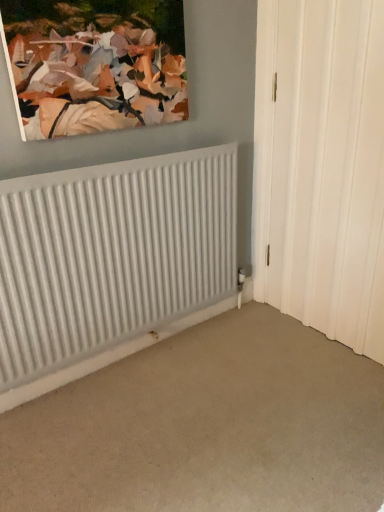
Question: Does white textured door at right have a greater width compared to matte canvas painting at upper left?

Choices:
 (A) yes
 (B) no

Answer: (B)

Question: Considering the relative positions of white textured door at right and matte canvas painting at upper left in the image provided, is white textured door at right to the right of matte canvas painting at upper left from the viewer's perspective?

Choices:
 (A) no
 (B) yes

Answer: (B)

Question: Is matte canvas painting at upper left at the back of white textured door at right?

Choices:
 (A) yes
 (B) no

Answer: (B)

Question: Would you say white textured door at right is outside matte canvas painting at upper left?

Choices:
 (A) yes
 (B) no

Answer: (A)

Question: Does white textured door at right have a greater height compared to matte canvas painting at upper left?

Choices:
 (A) no
 (B) yes

Answer: (B)

Question: Can you confirm if white textured door at right is shorter than matte canvas painting at upper left?

Choices:
 (A) yes
 (B) no

Answer: (B)

Question: Considering the relative sizes of white textured door at right and white ribbed radiator at lower left in the image provided, is white textured door at right smaller than white ribbed radiator at lower left?

Choices:
 (A) yes
 (B) no

Answer: (A)

Question: From a real-world perspective, is white textured door at right positioned over white ribbed radiator at lower left based on gravity?

Choices:
 (A) no
 (B) yes

Answer: (B)

Question: Is white textured door at right next to white ribbed radiator at lower left?

Choices:
 (A) yes
 (B) no

Answer: (B)

Question: Is white textured door at right positioned with its back to white ribbed radiator at lower left?

Choices:
 (A) yes
 (B) no

Answer: (B)

Question: Is the depth of white textured door at right less than that of white ribbed radiator at lower left?

Choices:
 (A) yes
 (B) no

Answer: (A)

Question: Is white textured door at right wider than white ribbed radiator at lower left?

Choices:
 (A) no
 (B) yes

Answer: (A)

Question: From the image's perspective, is matte canvas painting at upper left above white ribbed radiator at lower left?

Choices:
 (A) no
 (B) yes

Answer: (B)